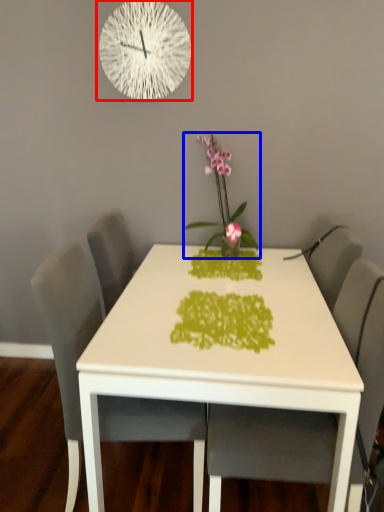
Question: Which object is closer to the camera taking this photo, wall clock (highlighted by a red box) or houseplant (highlighted by a blue box)?

Choices:
 (A) wall clock
 (B) houseplant

Answer: (B)